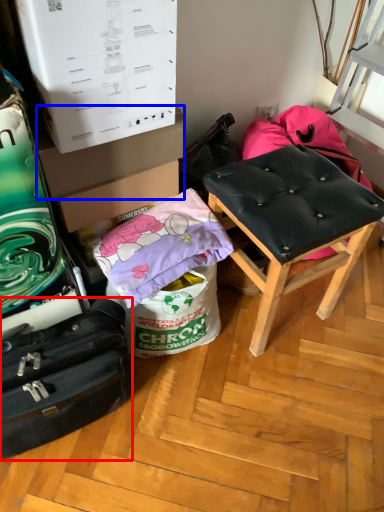
Question: Which of the following is the closest to the observer, suitcase (highlighted by a red box) or cardboard box (highlighted by a blue box)?

Choices:
 (A) suitcase
 (B) cardboard box

Answer: (A)